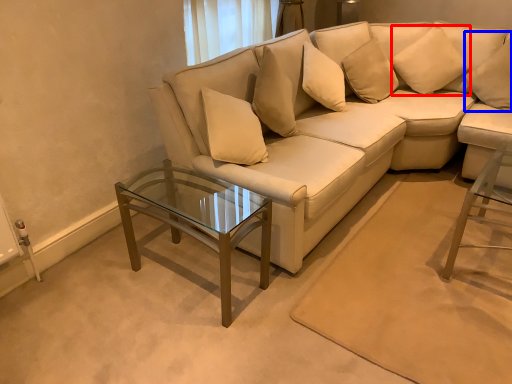
Question: Which object appears farthest to the camera in this image, pillow (highlighted by a red box) or pillow (highlighted by a blue box)?

Choices:
 (A) pillow
 (B) pillow

Answer: (A)